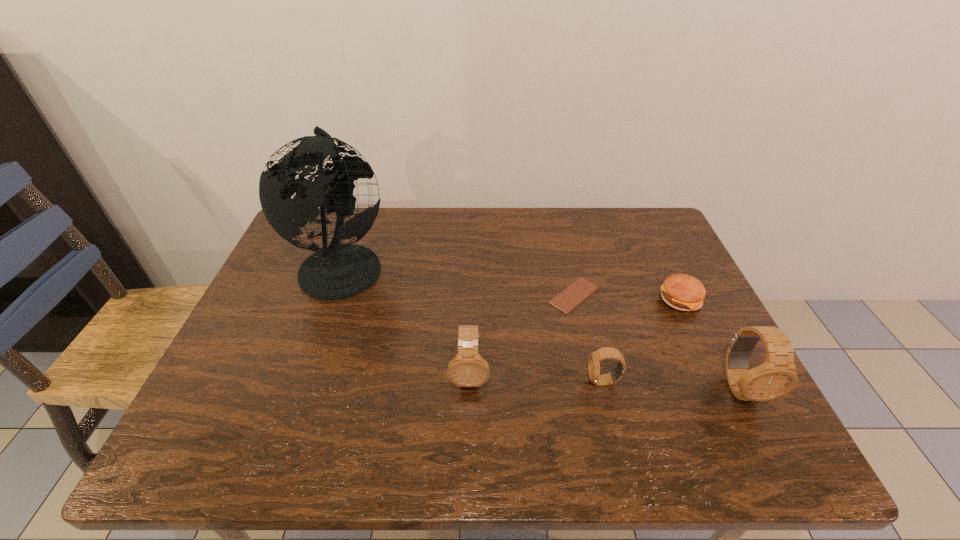
What are the coordinates of `the fifth object from right to left` in the screenshot? It's located at (467, 369).

Identify the location of the third tallest object. (467, 369).

You are a GUI agent. You are given a task and a screenshot of the screen. Output one action in this format:
    pyautogui.click(x=<x>, y=<y>)
    Task: Click on the second watch from left to right
    
    Given the screenshot: What is the action you would take?
    pyautogui.click(x=594, y=359)

The height and width of the screenshot is (540, 960). Find the location of `the shortest watch`. the shortest watch is located at coordinates (594, 359).

The width and height of the screenshot is (960, 540). Find the location of `the rightmost watch`. the rightmost watch is located at coordinates (777, 376).

Locate an element on the screen. Image resolution: width=960 pixels, height=540 pixels. hamburger is located at coordinates (683, 292).

Identify the location of globe. (339, 271).

This screenshot has height=540, width=960. Identify the location of the leftmost object. (339, 271).

Find the location of a particular element. chocolate bar is located at coordinates (581, 289).

Where is `blank area located on the face of the second watch from right to left`? blank area located on the face of the second watch from right to left is located at coordinates (533, 381).